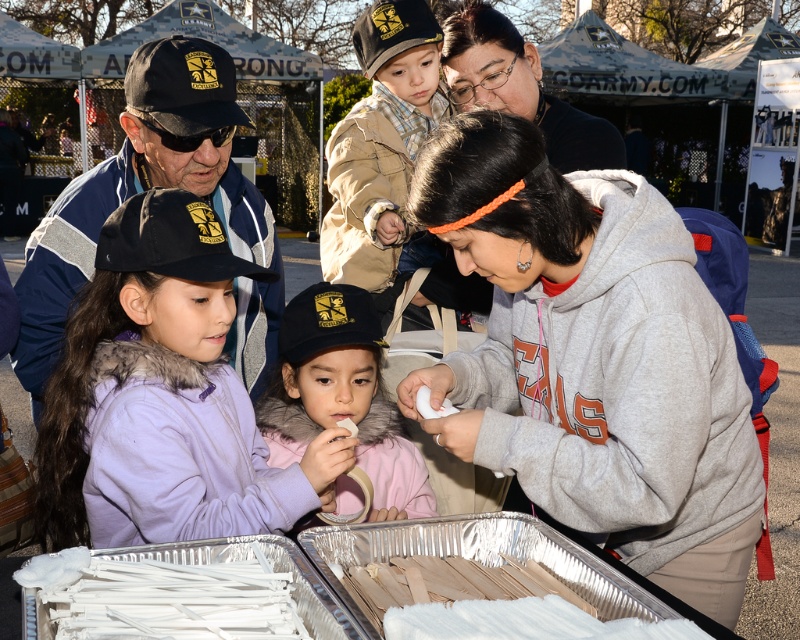
Question: Can you confirm if purple fleece jacket at center is thinner than pink fleece jacket at center?

Choices:
 (A) no
 (B) yes

Answer: (A)

Question: Is black matte cap at upper left to the left of white plastic straws at lower center from the viewer's perspective?

Choices:
 (A) yes
 (B) no

Answer: (A)

Question: Observing the image, what is the correct spatial positioning of purple fleece jacket at center in reference to white plastic straws at lower center?

Choices:
 (A) right
 (B) left

Answer: (B)

Question: Which of the following is the farthest from the observer?

Choices:
 (A) (484, 10)
 (B) (294, 458)
 (C) (72, 589)
 (D) (134, 300)

Answer: (A)

Question: Which object appears closest to the camera in this image?

Choices:
 (A) pink fleece jacket at center
 (B) white plastic straws at lower center
 (C) matte black hoodie at upper center

Answer: (B)

Question: Which object is closer to the camera taking this photo?

Choices:
 (A) gray fleece hoodie at center
 (B) pink fleece jacket at center
 (C) purple fleece jacket at center

Answer: (A)